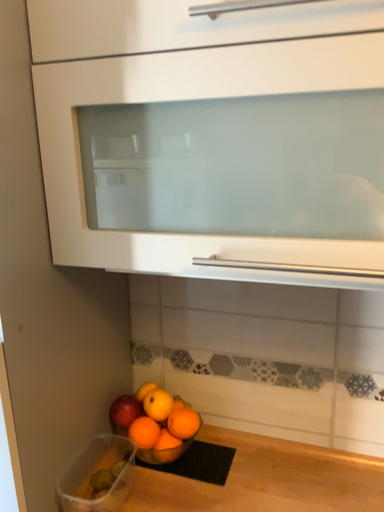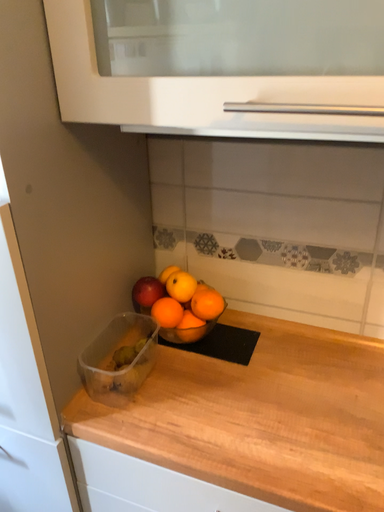
Question: How did the camera likely rotate when shooting the video?

Choices:
 (A) rotated upward
 (B) rotated downward

Answer: (B)